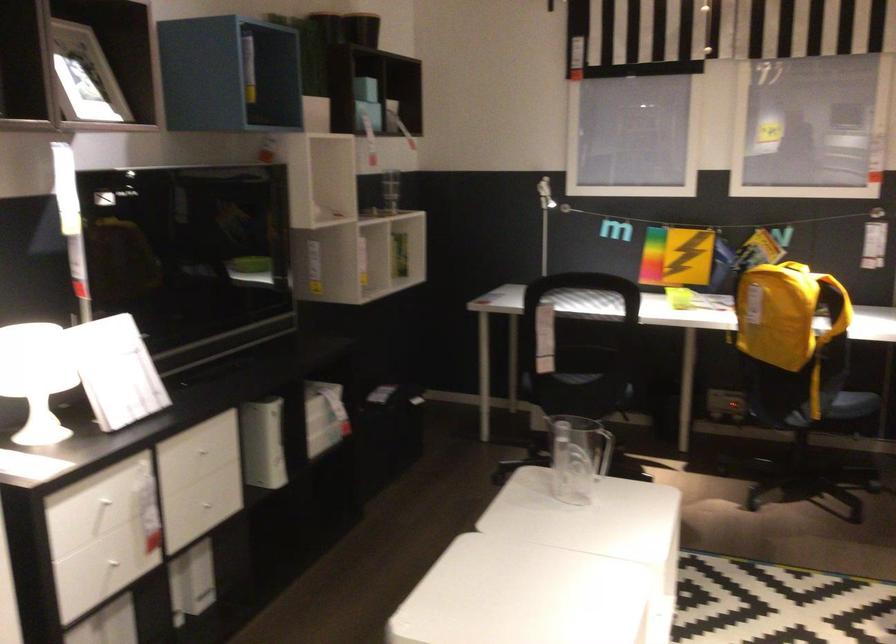
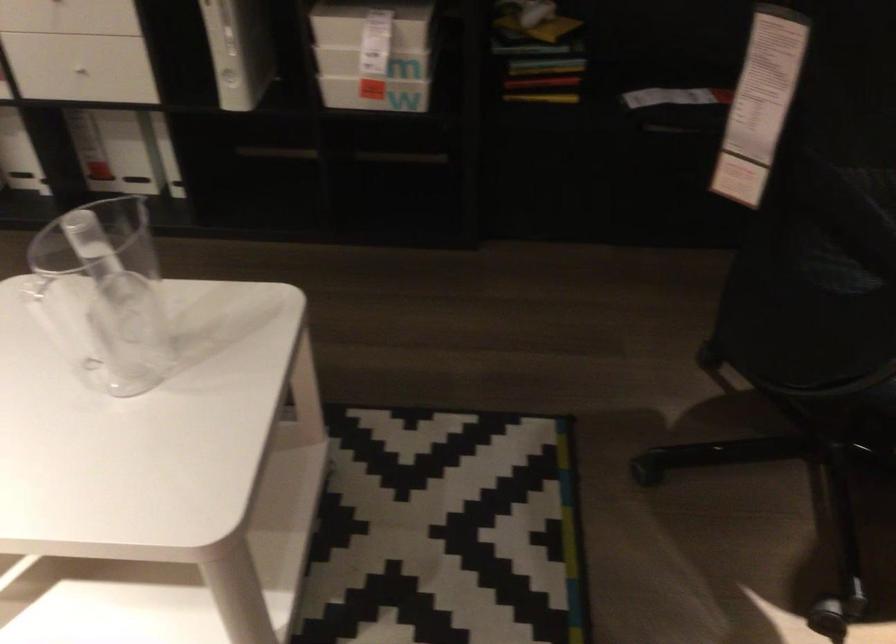
Locate, in the second image, the point that corresponds to [175,536] in the first image.

(75, 77)